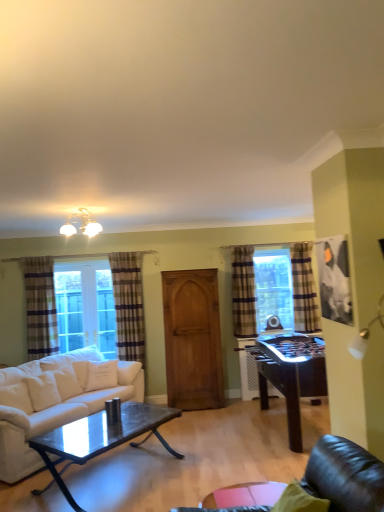
You are a GUI agent. You are given a task and a screenshot of the screen. Output one action in this format:
    pyautogui.click(x=<x>, y=<y>)
    Task: Click on the free spot in front of wooden armoire at center
    This screenshot has width=384, height=512.
    Given the screenshot: What is the action you would take?
    pyautogui.click(x=198, y=422)